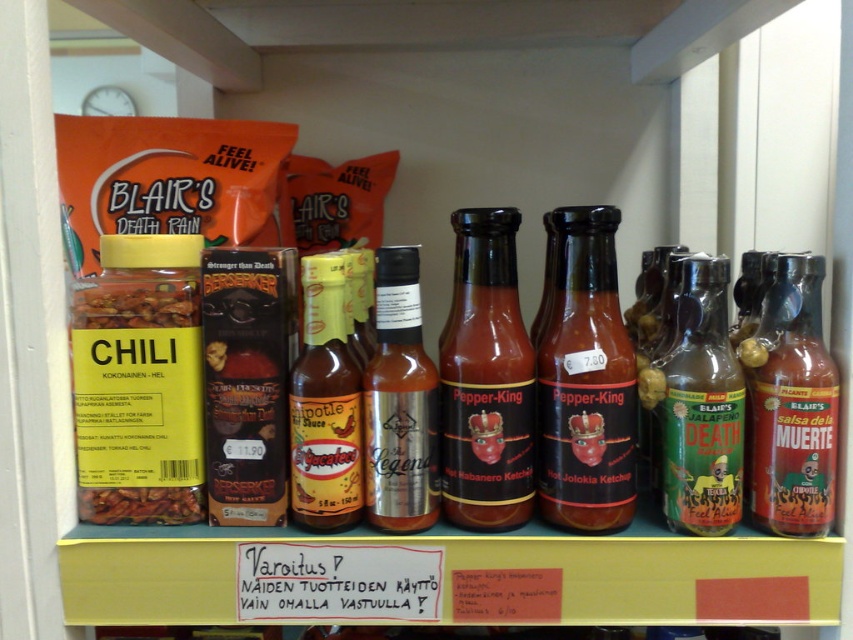
Can you confirm if green matte bottle at center-right is bigger than matte glass jar at center?

Indeed, green matte bottle at center-right has a larger size compared to matte glass jar at center.

Does green matte bottle at center-right have a greater height compared to matte glass jar at center?

Correct, green matte bottle at center-right is much taller as matte glass jar at center.

Is point (675, 413) closer to camera compared to point (136, 305)?

That is True.

You are a GUI agent. You are given a task and a screenshot of the screen. Output one action in this format:
    pyautogui.click(x=<x>, y=<y>)
    Task: Click on the green matte bottle at center-right
    Image resolution: width=853 pixels, height=640 pixels.
    Given the screenshot: What is the action you would take?
    pyautogui.click(x=701, y=406)

Who is shorter, matte glass bottle at center or brown powder at center?

Standing shorter between the two is brown powder at center.

Who is more distant from viewer, [477,250] or [202,509]?

Point [202,509]

Is point (474, 285) farther from camera compared to point (184, 488)?

No.

This screenshot has width=853, height=640. In order to click on matte glass bottle at center in this screenshot , I will do `click(486, 380)`.

Who is more distant from viewer, (537, 371) or (88, 490)?

The point (88, 490) is more distant.

Is point (590, 472) in front of point (140, 516)?

Yes, point (590, 472) is in front of point (140, 516).

Is point (614, 221) positioned in front of point (202, 502)?

Yes, point (614, 221) is in front of point (202, 502).

Find the location of a particular element. This screenshot has width=853, height=640. matte black pepper-king hot jolokia ketchup at center is located at coordinates (585, 381).